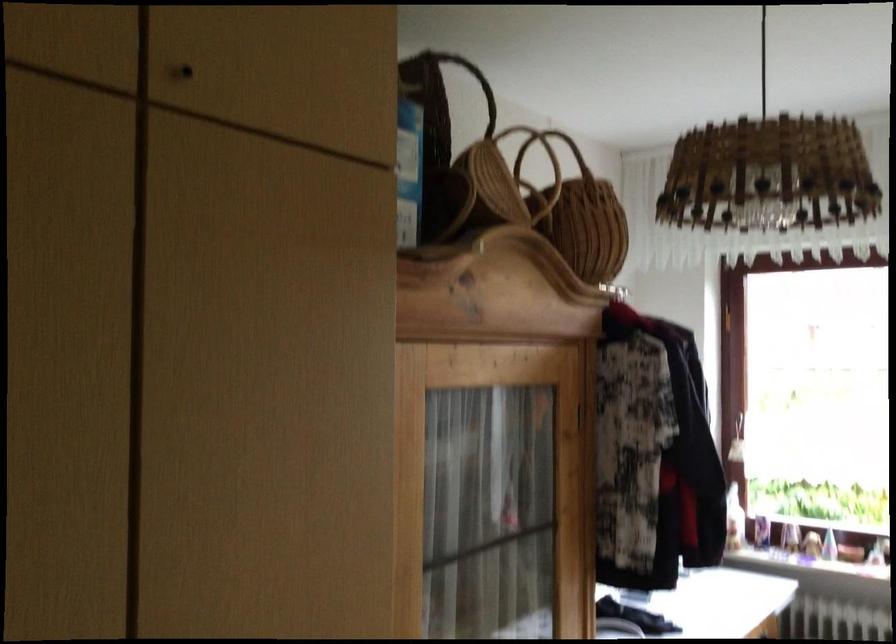
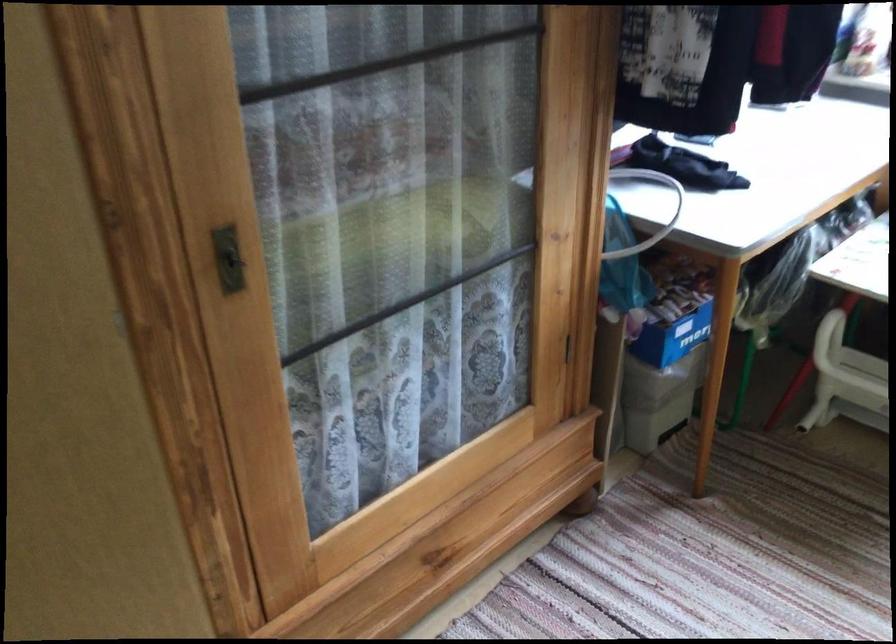
Question: How did the camera likely rotate?

Choices:
 (A) Left
 (B) Right
 (C) Up
 (D) Down

Answer: (D)